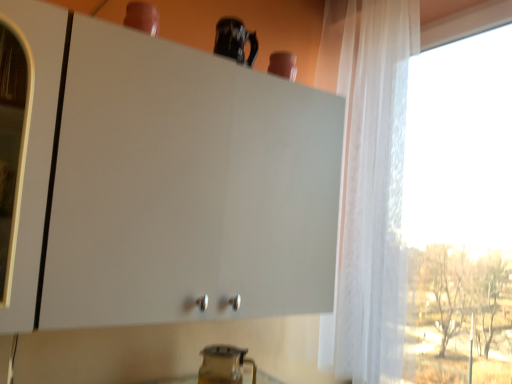
Question: From the image's perspective, is white matte cabinet at upper center under transparent glass pitcher at lower center, which appears as the 1th appliance when viewed from the back?

Choices:
 (A) no
 (B) yes

Answer: (A)

Question: Is transparent glass pitcher at lower center, the 2th appliance when ordered from front to back, inside white matte cabinet at upper center?

Choices:
 (A) no
 (B) yes

Answer: (A)

Question: Could you tell me if white matte cabinet at upper center is facing transparent glass pitcher at lower center, the 2th appliance in the top-to-bottom sequence?

Choices:
 (A) yes
 (B) no

Answer: (B)

Question: Is white matte cabinet at upper center closer to the viewer compared to transparent glass pitcher at lower center, the 2th appliance when ordered from front to back?

Choices:
 (A) yes
 (B) no

Answer: (A)

Question: Considering the relative sizes of white matte cabinet at upper center and transparent glass pitcher at lower center, the 2th appliance when ordered from front to back, in the image provided, is white matte cabinet at upper center thinner than transparent glass pitcher at lower center, the 2th appliance when ordered from front to back,?

Choices:
 (A) no
 (B) yes

Answer: (A)

Question: In terms of width, does glossy ceramic mug at upper center, positioned as the 2th appliance in bottom-to-top order, look wider or thinner when compared to transparent curtain at right?

Choices:
 (A) wide
 (B) thin

Answer: (B)

Question: Considering the positions of glossy ceramic mug at upper center, the 1th appliance viewed from the front, and transparent curtain at right in the image, is glossy ceramic mug at upper center, the 1th appliance viewed from the front, bigger or smaller than transparent curtain at right?

Choices:
 (A) small
 (B) big

Answer: (A)

Question: From the image's perspective, is glossy ceramic mug at upper center, the 1th appliance viewed from the front, located above or below transparent curtain at right?

Choices:
 (A) above
 (B) below

Answer: (A)

Question: In the image, is glossy ceramic mug at upper center, the 1th appliance viewed from the front, positioned in front of or behind transparent curtain at right?

Choices:
 (A) front
 (B) behind

Answer: (B)

Question: Is white matte cabinet at upper center spatially inside transparent curtain at right, or outside of it?

Choices:
 (A) inside
 (B) outside

Answer: (B)

Question: In the image, is white matte cabinet at upper center on the left side or the right side of transparent curtain at right?

Choices:
 (A) left
 (B) right

Answer: (A)

Question: Is white matte cabinet at upper center bigger or smaller than transparent curtain at right?

Choices:
 (A) small
 (B) big

Answer: (A)

Question: From the image's perspective, is white matte cabinet at upper center located above or below transparent curtain at right?

Choices:
 (A) above
 (B) below

Answer: (B)

Question: Considering the positions of point (219, 362) and point (59, 139), is point (219, 362) closer or farther from the camera than point (59, 139)?

Choices:
 (A) farther
 (B) closer

Answer: (A)

Question: In terms of height, does transparent glass pitcher at lower center, the 2th appliance in the top-to-bottom sequence, look taller or shorter compared to white matte cabinet at upper center?

Choices:
 (A) tall
 (B) short

Answer: (B)